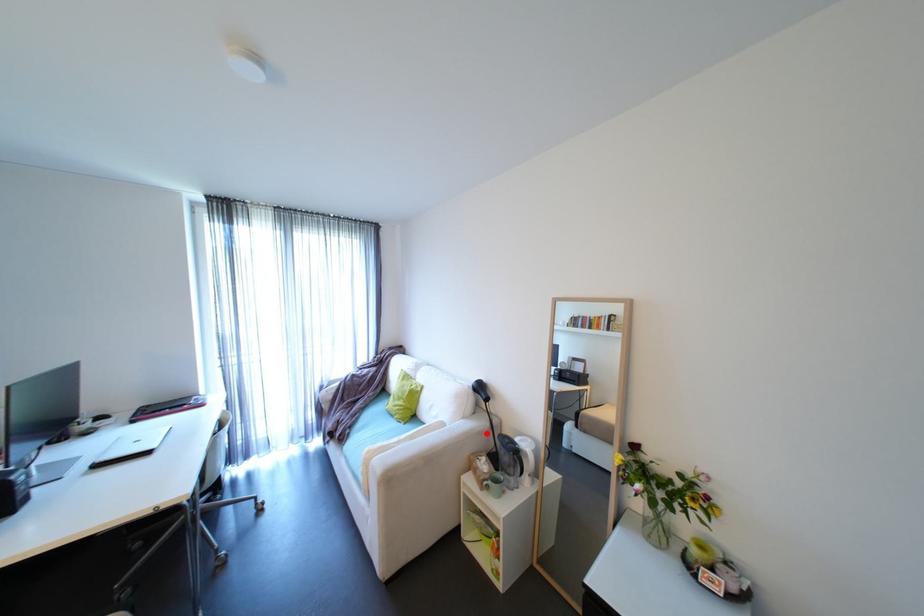
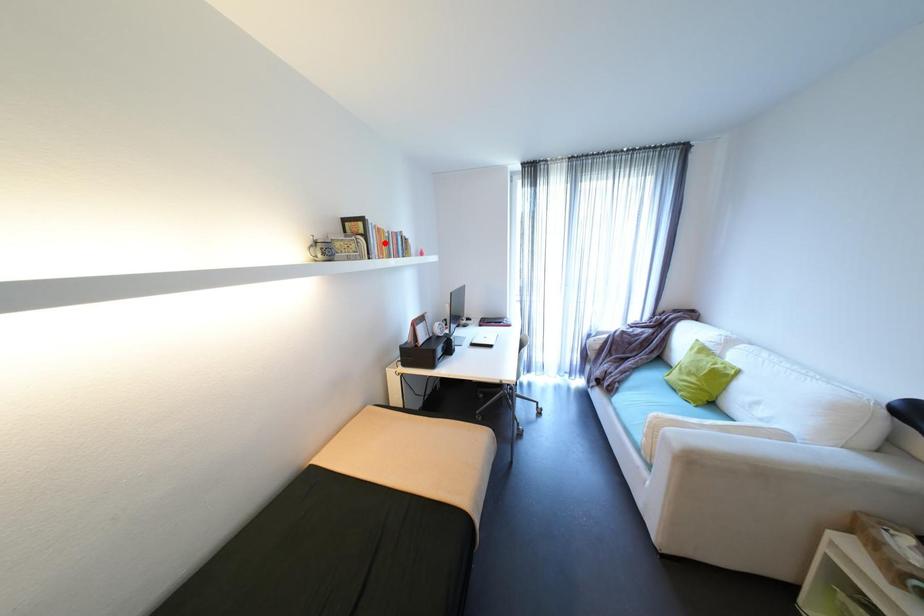
I am providing you with two images of the same scene from different viewpoints. A red point is marked on the first image and another point is marked on the second image. Does the point marked in image1 correspond to the same location as the one in image2?

No